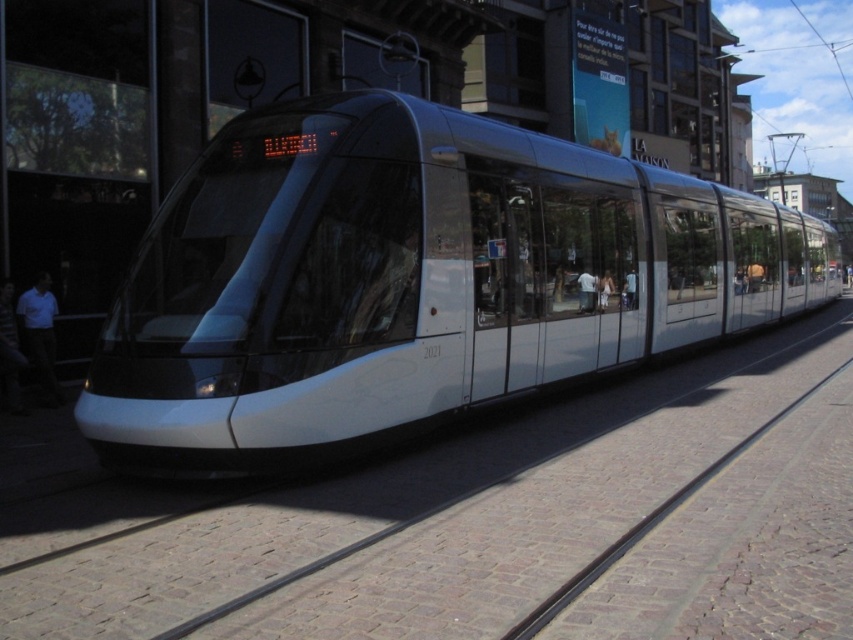
Question: Does white glossy train at center appear on the left side of white matte shirt at left?

Choices:
 (A) no
 (B) yes

Answer: (A)

Question: Is white glossy train at center bigger than white matte shirt at left?

Choices:
 (A) yes
 (B) no

Answer: (A)

Question: Which object appears farthest from the camera in this image?

Choices:
 (A) white glossy train at center
 (B) white matte shirt at left

Answer: (B)

Question: Does white glossy train at center appear under white matte shirt at left?

Choices:
 (A) yes
 (B) no

Answer: (B)